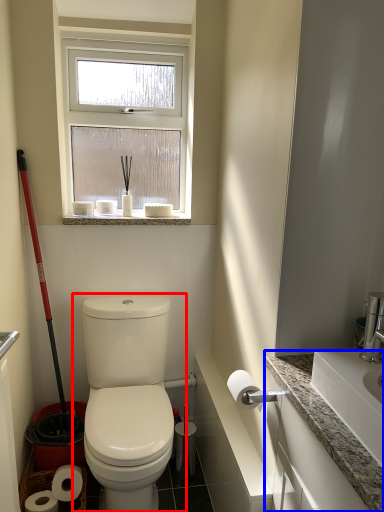
Question: Which object is closer to the camera taking this photo, toilet (highlighted by a red box) or counter top (highlighted by a blue box)?

Choices:
 (A) toilet
 (B) counter top

Answer: (B)